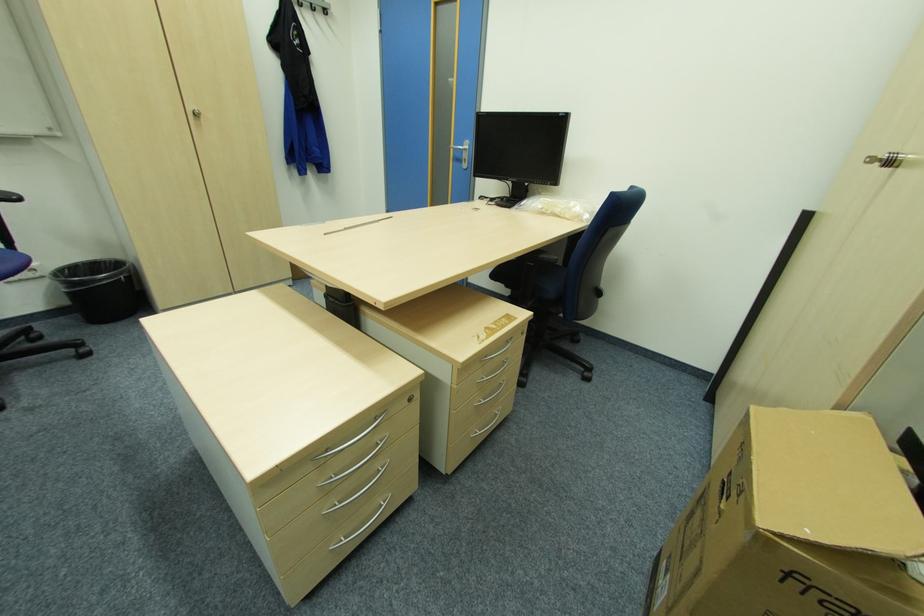
This screenshot has height=616, width=924. What do you see at coordinates (196, 111) in the screenshot?
I see `a silver cabinet knob` at bounding box center [196, 111].